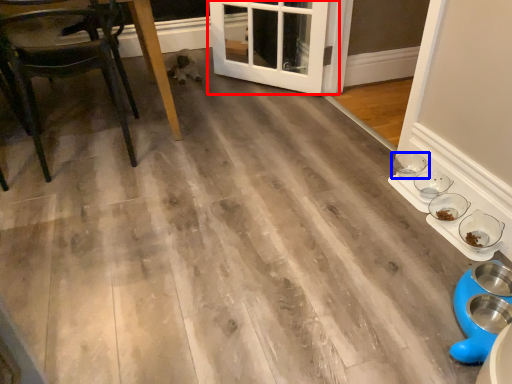
Question: Which object appears closest to the camera in this image, door (highlighted by a red box) or bowl (highlighted by a blue box)?

Choices:
 (A) door
 (B) bowl

Answer: (B)